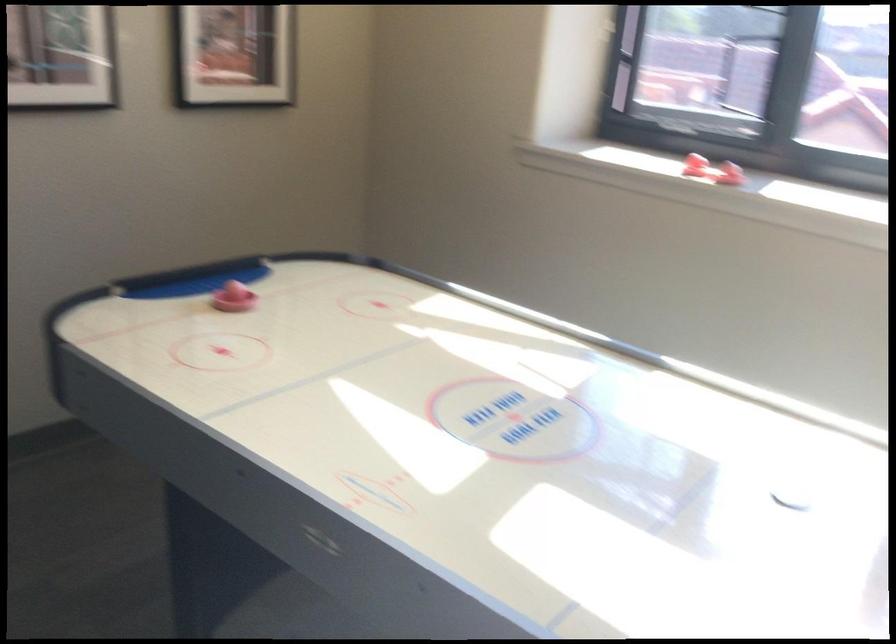
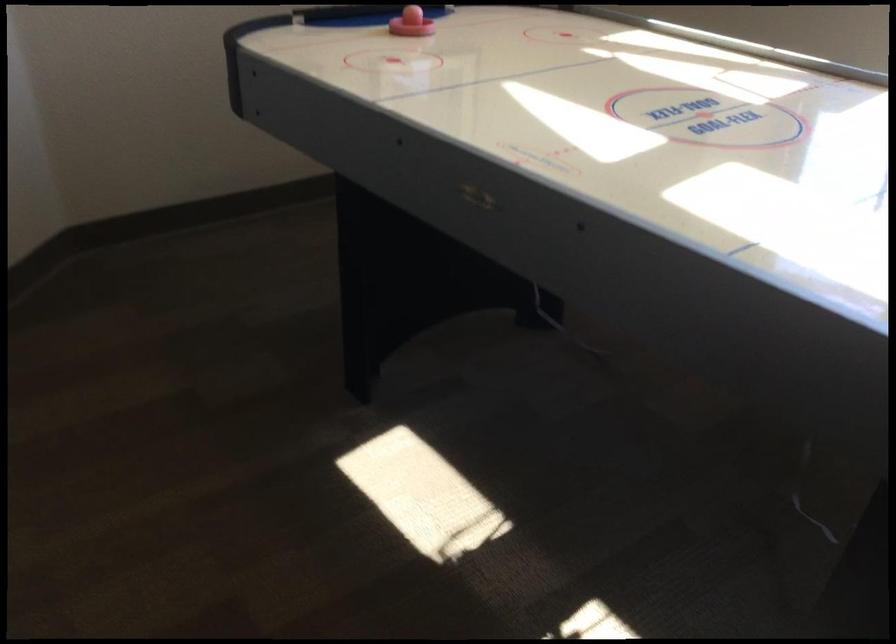
Where in the second image is the point corresponding to (228,301) from the first image?

(410, 23)